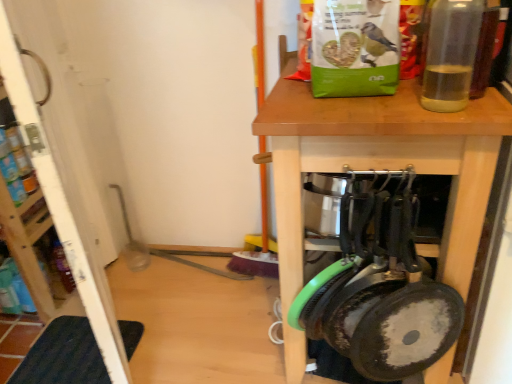
You are a GUI agent. You are given a task and a screenshot of the screen. Output one action in this format:
    pyautogui.click(x=<x>, y=<y>)
    Task: Click on the vacant area that lies to the right of white wood screen door at left
    
    Given the screenshot: What is the action you would take?
    pyautogui.click(x=180, y=308)